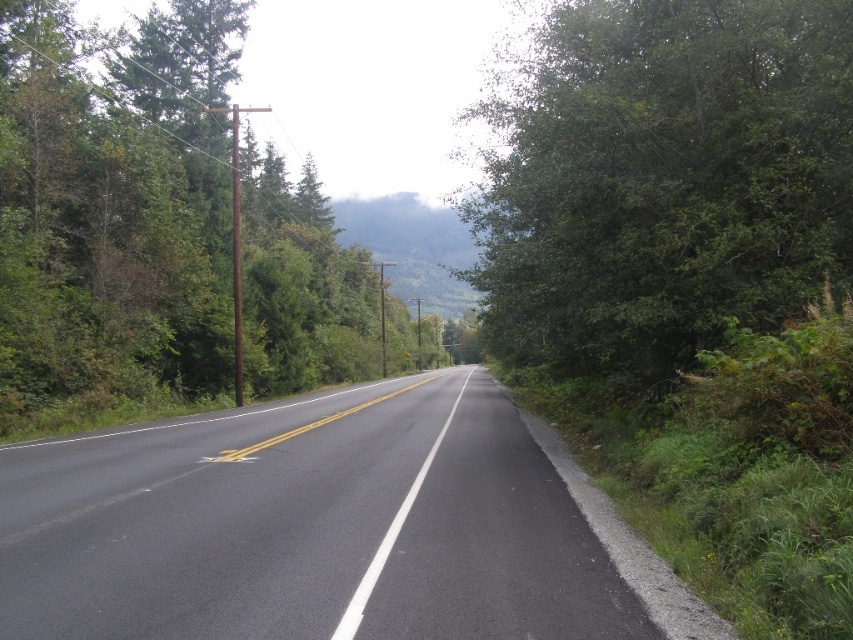
Question: Can you confirm if black asphalt road at center is positioned to the right of green leafy tree at right?

Choices:
 (A) yes
 (B) no

Answer: (B)

Question: Among these points, which one is farthest from the camera?

Choices:
 (A) (149, 65)
 (B) (798, 273)

Answer: (A)

Question: Is black asphalt road at center above green leafy tree at right?

Choices:
 (A) no
 (B) yes

Answer: (A)

Question: Which of these objects is positioned closest to the green leafy tree at left?

Choices:
 (A) green leafy tree at right
 (B) black asphalt road at center

Answer: (A)

Question: Which object is the farthest from the black asphalt road at center?

Choices:
 (A) green leafy tree at right
 (B) green leafy tree at left

Answer: (B)

Question: Is black asphalt road at center smaller than green leafy tree at left?

Choices:
 (A) yes
 (B) no

Answer: (A)